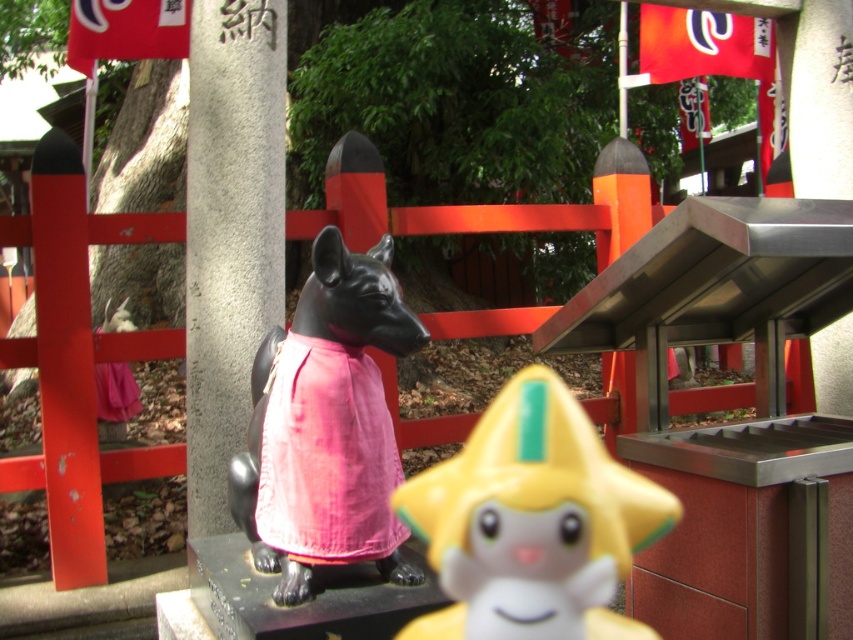
Which is more to the right, black matte dog at center or pink cotton dress at center?

black matte dog at center

Is black matte dog at center bigger than pink cotton dress at center?

Correct, black matte dog at center is larger in size than pink cotton dress at center.

Which is behind, point (381, 484) or point (306, 502)?

Point (381, 484)

This screenshot has height=640, width=853. What are the coordinates of `black matte dog at center` in the screenshot? It's located at (326, 426).

Is gray stone pillar at center taller than pink cotton dress at center?

Indeed, gray stone pillar at center has a greater height compared to pink cotton dress at center.

Is gray stone pillar at center bigger than pink cotton dress at center?

Yes, gray stone pillar at center is bigger than pink cotton dress at center.

The height and width of the screenshot is (640, 853). Find the location of `gray stone pillar at center`. gray stone pillar at center is located at coordinates (230, 230).

Can you confirm if black matte dog at center is shorter than gray stone pillar at center?

Correct, black matte dog at center is not as tall as gray stone pillar at center.

This screenshot has width=853, height=640. I want to click on black matte dog at center, so 326,426.

Where is `black matte dog at center`? black matte dog at center is located at coordinates (326, 426).